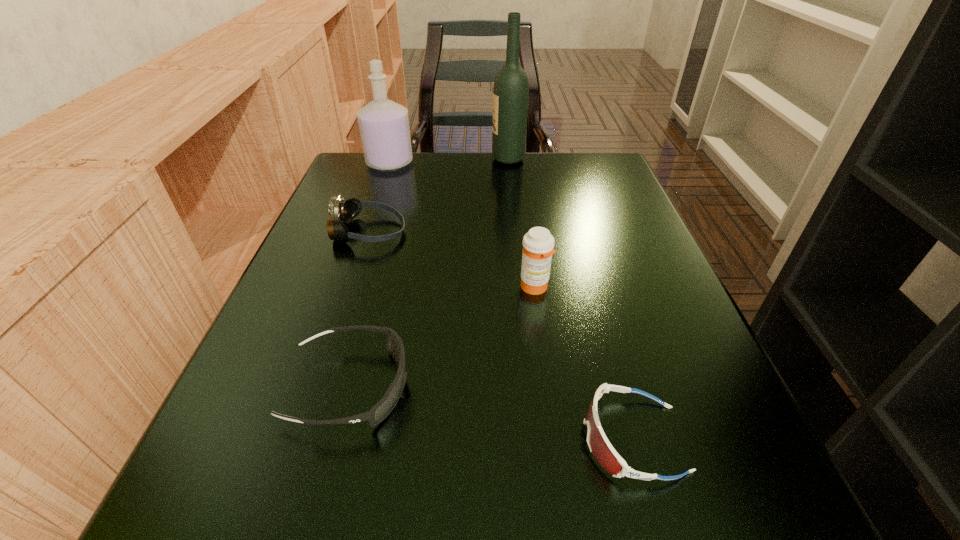
This screenshot has width=960, height=540. I want to click on object present at the far left corner, so click(x=384, y=124).

Locate an element on the screen. The width and height of the screenshot is (960, 540). object that is at the near right corner is located at coordinates (599, 445).

The height and width of the screenshot is (540, 960). Find the location of `vacant space at the far edge`. vacant space at the far edge is located at coordinates (438, 154).

Where is `free point at the near edge`? The image size is (960, 540). free point at the near edge is located at coordinates (483, 500).

The height and width of the screenshot is (540, 960). I want to click on free space at the left edge of the desktop, so click(318, 226).

In the image, there is a desktop. Identify the location of blank space at the right edge. The height and width of the screenshot is (540, 960). (628, 215).

Locate an element on the screen. free space at the far right corner of the desktop is located at coordinates (600, 156).

This screenshot has width=960, height=540. In the image, there is a desktop. Find the location of `free region at the near right corner`. free region at the near right corner is located at coordinates 745,538.

You are a GUI agent. You are given a task and a screenshot of the screen. Output one action in this format:
    pyautogui.click(x=<x>, y=<y>)
    Task: Click on the free point between the perfume and the rightmost goggles
    
    Given the screenshot: What is the action you would take?
    pyautogui.click(x=512, y=301)

Identify the location of free point between the rightmost object and the tallest object. (570, 299).